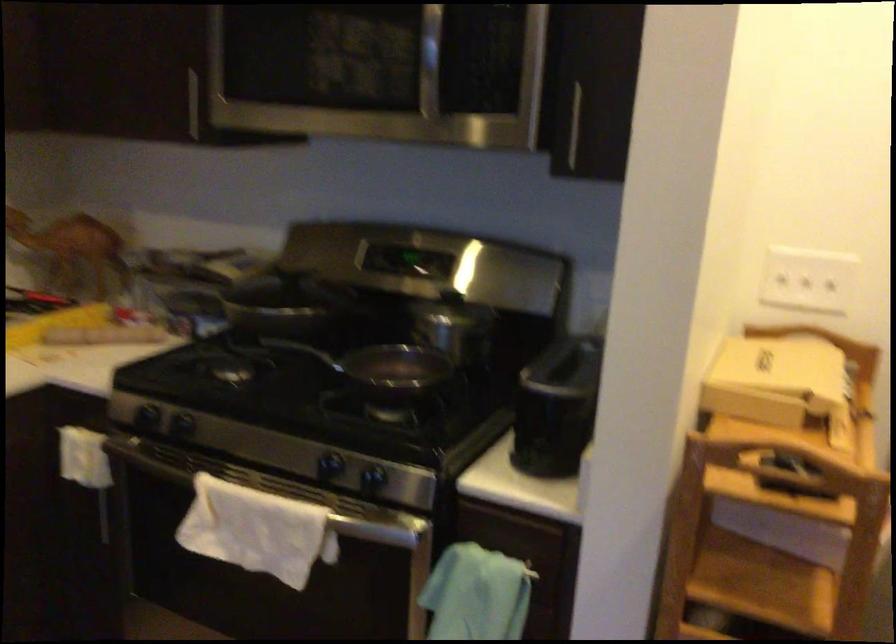
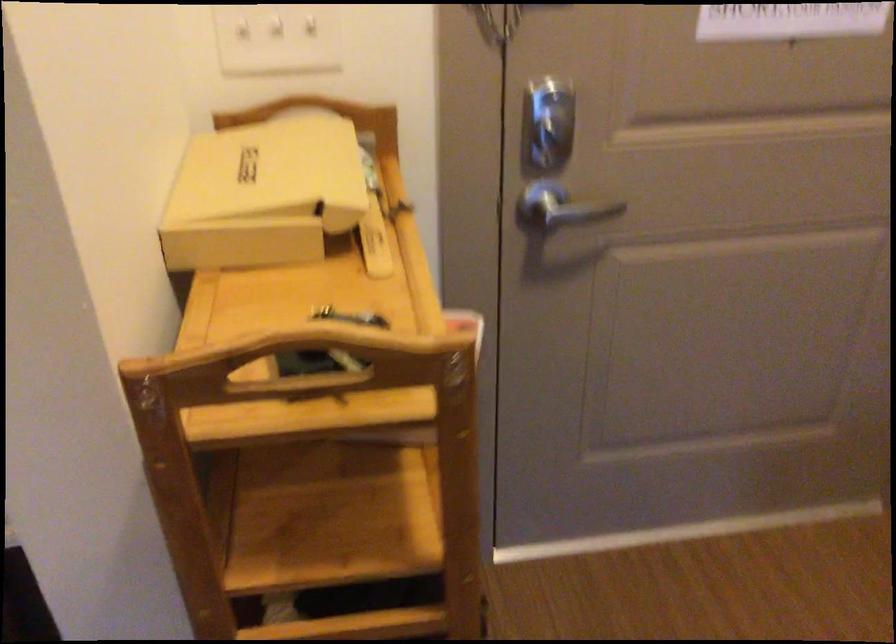
The first image is from the beginning of the video and the second image is from the end. How did the camera likely rotate when shooting the video?

The rotation direction of the camera is right-down.